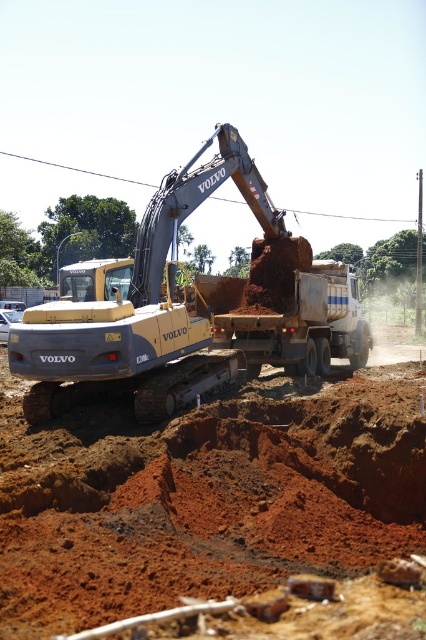
Does yellow metallic excavator at center appear under brown clay trailer truck at center?

Incorrect, yellow metallic excavator at center is not positioned below brown clay trailer truck at center.

Does yellow metallic excavator at center have a lesser height compared to brown clay trailer truck at center?

In fact, yellow metallic excavator at center may be taller than brown clay trailer truck at center.

Is point (71, 310) closer to viewer compared to point (224, 285)?

Yes, it is.

Where is `yellow metallic excavator at center`? The image size is (426, 640). yellow metallic excavator at center is located at coordinates (149, 289).